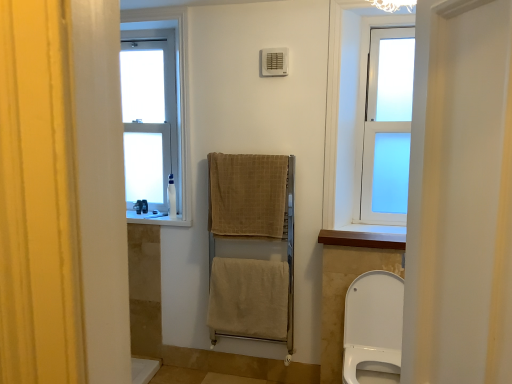
Question: From the image's perspective, is white frosted glass window at upper right, the first window in the front-to-back sequence, located above wooden at upper center, which is the first window sill from bottom to top?

Choices:
 (A) no
 (B) yes

Answer: (B)

Question: Is white frosted glass window at upper right, the first window in the front-to-back sequence, further to the viewer compared to wooden at upper center, which is the first window sill from bottom to top?

Choices:
 (A) no
 (B) yes

Answer: (B)

Question: From a real-world perspective, is white frosted glass window at upper right, acting as the second window starting from the back, beneath wooden at upper center, positioned as the 2th window sill in back-to-front order?

Choices:
 (A) no
 (B) yes

Answer: (A)

Question: Considering the relative sizes of white frosted glass window at upper right, which ranks as the 2th window in left-to-right order, and wooden at upper center, placed as the 1th window sill when sorted from front to back, in the image provided, is white frosted glass window at upper right, which ranks as the 2th window in left-to-right order, taller than wooden at upper center, placed as the 1th window sill when sorted from front to back,?

Choices:
 (A) no
 (B) yes

Answer: (B)

Question: Can you confirm if white frosted glass window at upper right, the first window in the front-to-back sequence, is positioned to the right of wooden at upper center, which is the second window sill from left to right?

Choices:
 (A) yes
 (B) no

Answer: (A)

Question: Is white frosted glass window at upper left, the second window in the front-to-back sequence, in front of or behind white glossy toilet at lower right in the image?

Choices:
 (A) front
 (B) behind

Answer: (B)

Question: Based on their positions, is white frosted glass window at upper left, which is the 1th window in left-to-right order, located to the left or right of white glossy toilet at lower right?

Choices:
 (A) right
 (B) left

Answer: (B)

Question: From a real-world perspective, is white frosted glass window at upper left, the second window in the front-to-back sequence, physically located above or below white glossy toilet at lower right?

Choices:
 (A) below
 (B) above

Answer: (B)

Question: In terms of size, does white frosted glass window at upper left, which ranks as the 2th window in right-to-left order, appear bigger or smaller than white glossy toilet at lower right?

Choices:
 (A) big
 (B) small

Answer: (B)

Question: Is white plastic bottle at left, which ranks as the 1th toiletry in back-to-front order, in front of or behind beige cotton towel at center, positioned as the first bath towel in bottom-to-top order, in the image?

Choices:
 (A) front
 (B) behind

Answer: (B)

Question: From the image's perspective, relative to beige cotton towel at center, positioned as the first bath towel in bottom-to-top order, is white plastic bottle at left, arranged as the second toiletry when viewed from the right, above or below?

Choices:
 (A) below
 (B) above

Answer: (B)

Question: Considering the positions of white plastic bottle at left, the first toiletry from the left, and beige cotton towel at center, arranged as the 3th bath towel when viewed from the top, in the image, is white plastic bottle at left, the first toiletry from the left, bigger or smaller than beige cotton towel at center, arranged as the 3th bath towel when viewed from the top,?

Choices:
 (A) big
 (B) small

Answer: (B)

Question: Looking at their shapes, would you say white plastic bottle at left, arranged as the second toiletry when viewed from the right, is wider or thinner than beige cotton towel at center, arranged as the 3th bath towel when viewed from the top?

Choices:
 (A) wide
 (B) thin

Answer: (B)

Question: From the image's perspective, relative to white frosted glass window at upper right, the first window in the front-to-back sequence, is beige cotton towel at center, arranged as the 3th bath towel when viewed from the top, above or below?

Choices:
 (A) above
 (B) below

Answer: (B)

Question: Would you say beige cotton towel at center, positioned as the first bath towel in bottom-to-top order, is inside or outside white frosted glass window at upper right, the first window in the front-to-back sequence?

Choices:
 (A) outside
 (B) inside

Answer: (A)